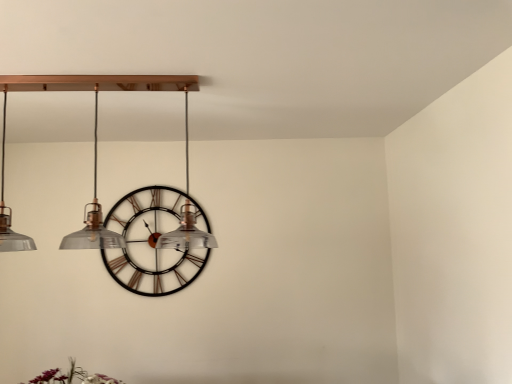
Question: Considering the relative positions of metallic black clock at center and matte glass chandelier at upper center in the image provided, is metallic black clock at center to the right of matte glass chandelier at upper center from the viewer's perspective?

Choices:
 (A) no
 (B) yes

Answer: (A)

Question: From the image's perspective, is metallic black clock at center located beneath matte glass chandelier at upper center?

Choices:
 (A) yes
 (B) no

Answer: (A)

Question: Can you confirm if metallic black clock at center is positioned to the left of matte glass chandelier at upper center?

Choices:
 (A) yes
 (B) no

Answer: (A)

Question: Does metallic black clock at center come behind matte glass chandelier at upper center?

Choices:
 (A) no
 (B) yes

Answer: (B)

Question: Is matte glass chandelier at upper center surrounded by metallic black clock at center?

Choices:
 (A) yes
 (B) no

Answer: (B)

Question: Does metallic black clock at center have a greater width compared to matte glass chandelier at upper center?

Choices:
 (A) yes
 (B) no

Answer: (B)

Question: Does matte glass chandelier at upper center have a larger size compared to metallic black clock at center?

Choices:
 (A) no
 (B) yes

Answer: (B)

Question: From the image's perspective, is matte glass chandelier at upper center over metallic black clock at center?

Choices:
 (A) no
 (B) yes

Answer: (B)

Question: Is matte glass chandelier at upper center aimed at metallic black clock at center?

Choices:
 (A) no
 (B) yes

Answer: (A)

Question: Is matte glass chandelier at upper center oriented away from metallic black clock at center?

Choices:
 (A) yes
 (B) no

Answer: (A)

Question: From a real-world perspective, is matte glass chandelier at upper center beneath metallic black clock at center?

Choices:
 (A) yes
 (B) no

Answer: (B)

Question: Does matte glass chandelier at upper center come behind metallic black clock at center?

Choices:
 (A) no
 (B) yes

Answer: (A)

Question: In terms of width, does matte glass chandelier at upper center look wider or thinner when compared to metallic black clock at center?

Choices:
 (A) wide
 (B) thin

Answer: (A)